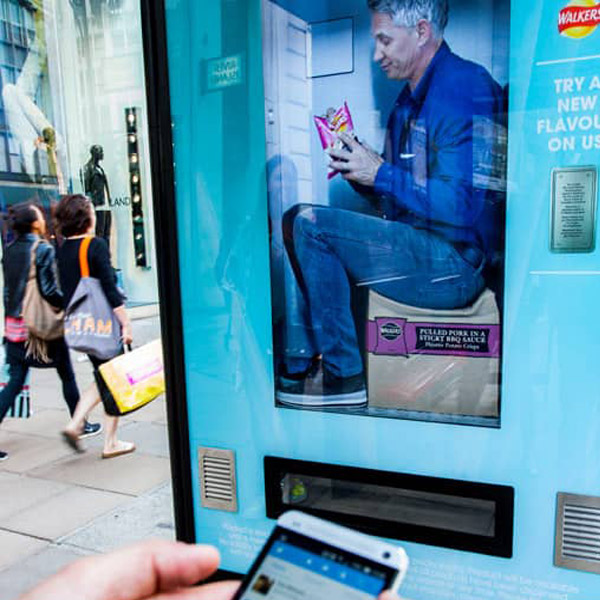
You are a GUI agent. You are given a task and a screenshot of the screen. Output one action in this format:
    pyautogui.click(x=<x>, y=<y>)
    Task: Click on the vent
    
    Given the screenshot: What is the action you would take?
    pyautogui.click(x=211, y=476)